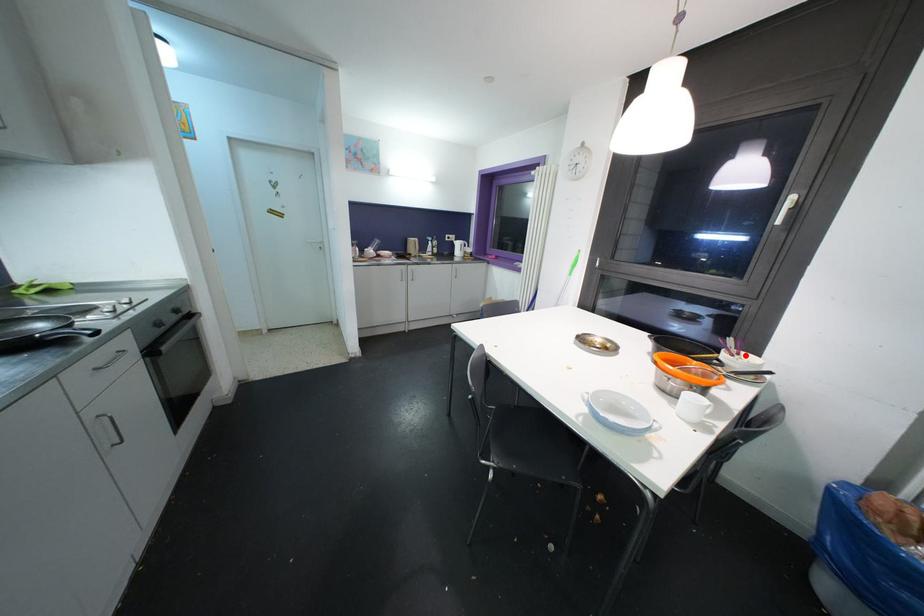
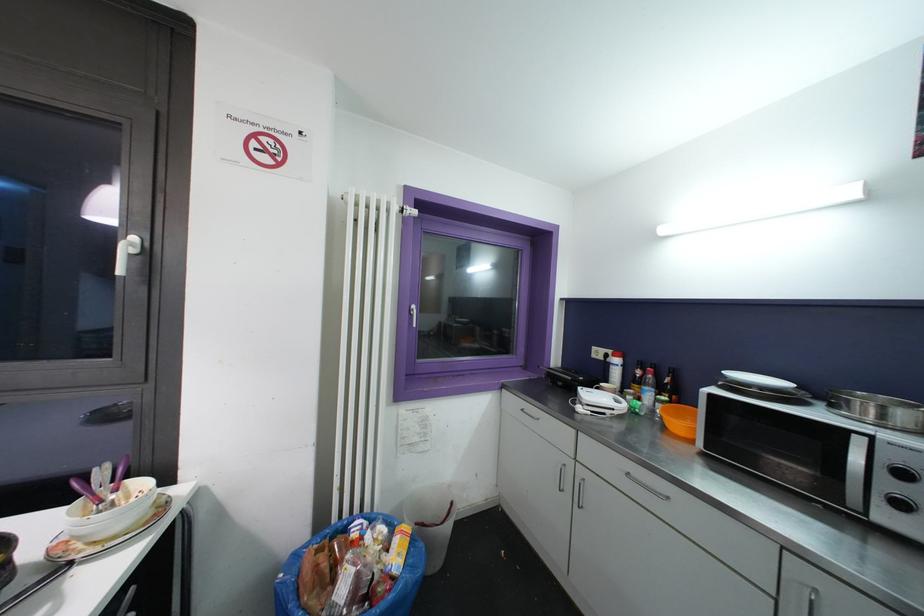
In the second image, find the point that corresponds to the highlighted location in the first image.

(131, 484)